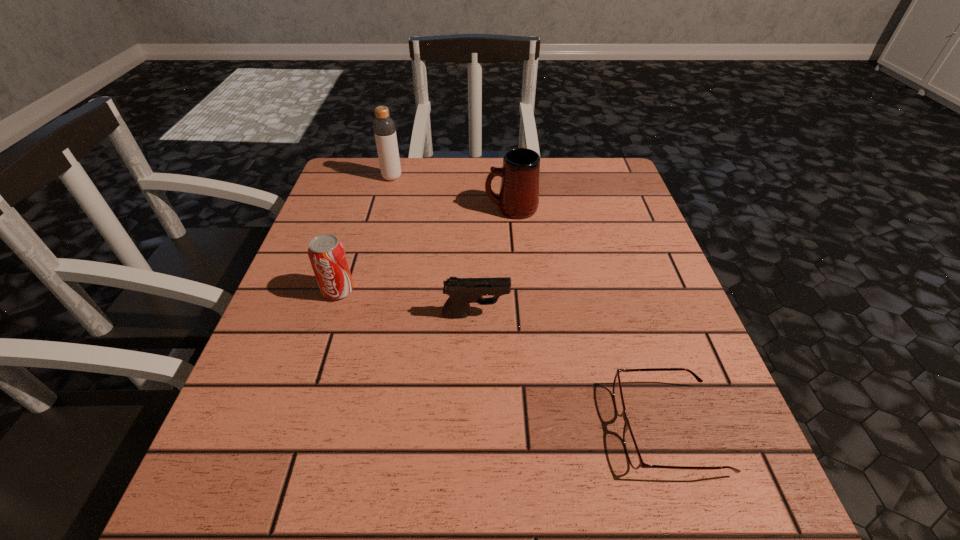
At what (x,y) coordinates should I click in order to perform the action: click on free area in between the rightmost object and the third shortest object. Please return your answer as a coordinate pair (x, y). The width and height of the screenshot is (960, 540). Looking at the image, I should click on [503, 359].

This screenshot has height=540, width=960. Identify the location of the third closest object to the fourth nearest object. (326, 253).

Choose which object is the nearest neighbor to the farthest object. Please provide its 2D coordinates. Your answer should be formatted as a tuple, i.e. [(x, y)], where the tuple contains the x and y coordinates of a point satisfying the conditions above.

[(519, 192)]

Where is `free space that satisfies the following two spatial constraints: 1. on the side of the fourth nearest object with the handle; 2. on the logo side of the third tallest object`? The height and width of the screenshot is (540, 960). free space that satisfies the following two spatial constraints: 1. on the side of the fourth nearest object with the handle; 2. on the logo side of the third tallest object is located at coordinates (518, 291).